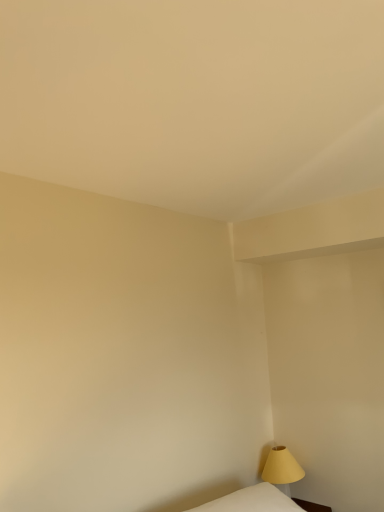
Measure the distance between point (264, 511) and camera.

Point (264, 511) and camera are 1.73 meters apart from each other.

Describe the element at coordinates (252, 501) in the screenshot. The image size is (384, 512). I see `white fabric mattress at lower right` at that location.

This screenshot has width=384, height=512. In order to click on white fabric mattress at lower right in this screenshot , I will do `click(252, 501)`.

Find the location of a particular element. Image resolution: width=384 pixels, height=512 pixels. white fabric mattress at lower right is located at coordinates (252, 501).